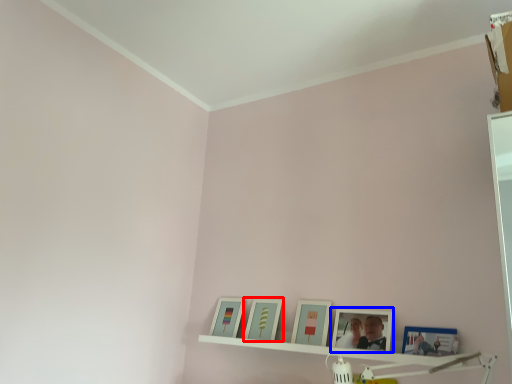
Question: Among these objects, which one is farthest to the camera, picture frame (highlighted by a red box) or picture frame (highlighted by a blue box)?

Choices:
 (A) picture frame
 (B) picture frame

Answer: (A)